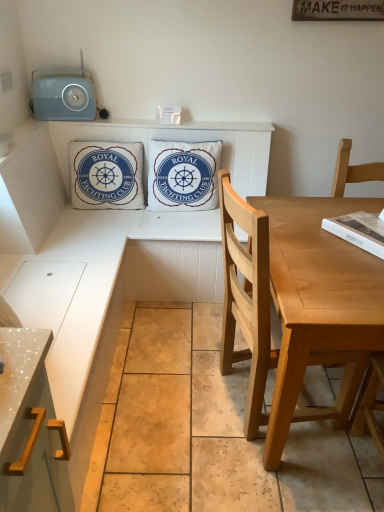
Question: Does light wood chair at right have a smaller size compared to matte blue radio at upper left?

Choices:
 (A) no
 (B) yes

Answer: (A)

Question: Is matte blue radio at upper left a part of light wood chair at right?

Choices:
 (A) yes
 (B) no

Answer: (B)

Question: Could you tell me if light wood chair at right is facing matte blue radio at upper left?

Choices:
 (A) no
 (B) yes

Answer: (A)

Question: Is light wood chair at right not within matte blue radio at upper left?

Choices:
 (A) yes
 (B) no

Answer: (A)

Question: From a real-world perspective, does light wood chair at right stand above matte blue radio at upper left?

Choices:
 (A) yes
 (B) no

Answer: (B)

Question: Is the depth of light wood chair at right less than that of matte blue radio at upper left?

Choices:
 (A) no
 (B) yes

Answer: (B)

Question: From the image's perspective, is white cotton cushion at center, positioned as the 1th pillow in right-to-left order, beneath white cotton cushion at upper center, which is counted as the 2th pillow, starting from the right?

Choices:
 (A) no
 (B) yes

Answer: (B)

Question: Considering the relative positions of white cotton cushion at center, the second pillow when ordered from left to right, and white cotton cushion at upper center, the first pillow viewed from the left, in the image provided, is white cotton cushion at center, the second pillow when ordered from left to right, to the right of white cotton cushion at upper center, the first pillow viewed from the left, from the viewer's perspective?

Choices:
 (A) no
 (B) yes

Answer: (B)

Question: From a real-world perspective, does white cotton cushion at center, positioned as the 1th pillow in right-to-left order, stand above white cotton cushion at upper center, the first pillow viewed from the left?

Choices:
 (A) no
 (B) yes

Answer: (B)

Question: Does white cotton cushion at center, the second pillow when ordered from left to right, have a greater width compared to white cotton cushion at upper center, the first pillow viewed from the left?

Choices:
 (A) no
 (B) yes

Answer: (B)

Question: Can you confirm if white cotton cushion at center, positioned as the 1th pillow in right-to-left order, is shorter than white cotton cushion at upper center, which is counted as the 2th pillow, starting from the right?

Choices:
 (A) no
 (B) yes

Answer: (B)

Question: Is white cotton cushion at center, the second pillow when ordered from left to right, bigger than white cotton cushion at upper center, the first pillow viewed from the left?

Choices:
 (A) yes
 (B) no

Answer: (A)

Question: Considering the relative sizes of white cotton cushion at center, positioned as the 1th pillow in right-to-left order, and metallic gold cabinet handle at lower left in the image provided, is white cotton cushion at center, positioned as the 1th pillow in right-to-left order, wider than metallic gold cabinet handle at lower left?

Choices:
 (A) no
 (B) yes

Answer: (A)